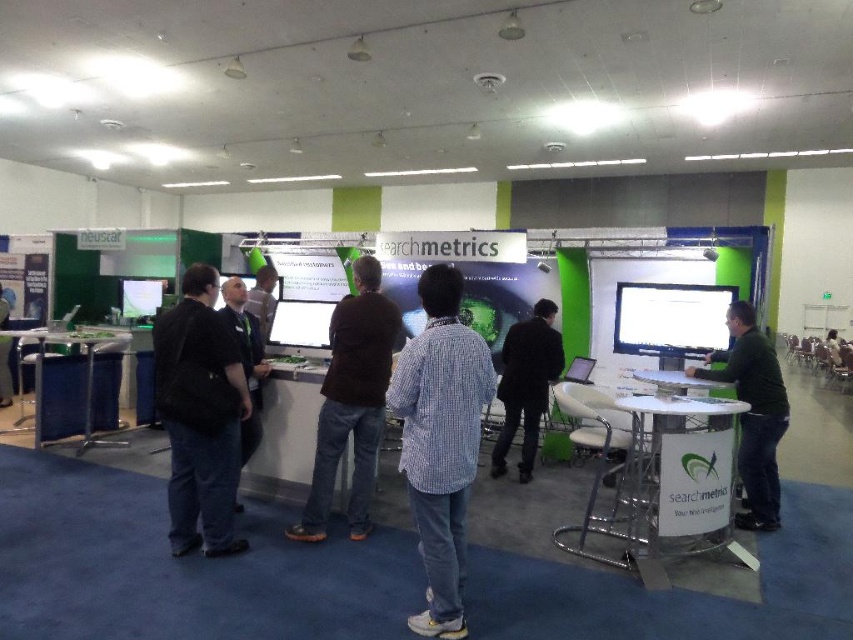
Question: In this image, where is dark green shirt at right located relative to dark brown leather jacket at center?

Choices:
 (A) below
 (B) above

Answer: (A)

Question: Which object is farther from the camera taking this photo?

Choices:
 (A) dark brown leather jacket at center
 (B) matte black jacket at center
 (C) black matte shirt at center

Answer: (B)

Question: Which object is the farthest from the dark brown leather jacket at center?

Choices:
 (A) checkered shirt at center
 (B) black glossy tablet at center

Answer: (A)

Question: Can you confirm if black matte shirt at center is positioned to the left of dark green shirt at right?

Choices:
 (A) yes
 (B) no

Answer: (A)

Question: Among these points, which one is farthest from the camera?

Choices:
 (A) (575, 358)
 (B) (511, 365)
 (C) (236, 307)
 (D) (4, 353)

Answer: (D)

Question: Observing the image, what is the correct spatial positioning of black fabric shirt at center in reference to black glossy tablet at center?

Choices:
 (A) above
 (B) below

Answer: (A)